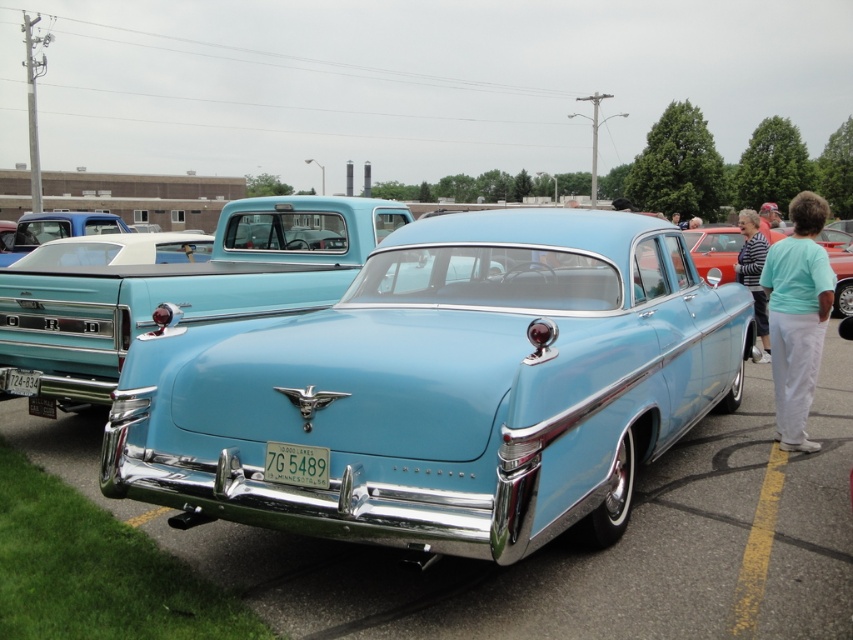
Question: Among these points, which one is farthest from the camera?

Choices:
 (A) (758, 256)
 (B) (212, 467)
 (C) (758, 611)
 (D) (35, 371)

Answer: (A)

Question: Which object is closer to the camera taking this photo?

Choices:
 (A) light blue glossy sedan at center
 (B) green matte license plate at center
 (C) light blue cotton pants at right

Answer: (B)

Question: From the image, what is the correct spatial relationship of yellow painted line at lower right in relation to green matte license plate at center?

Choices:
 (A) above
 (B) below

Answer: (B)

Question: Can you confirm if light blue metallic car at center is thinner than light blue cotton pants at right?

Choices:
 (A) yes
 (B) no

Answer: (B)

Question: Is yellow painted line at lower right to the right of striped fabric shirt at center from the viewer's perspective?

Choices:
 (A) no
 (B) yes

Answer: (A)

Question: Among these objects, which one is nearest to the camera?

Choices:
 (A) green matte license plate at center
 (B) striped fabric shirt at center

Answer: (A)